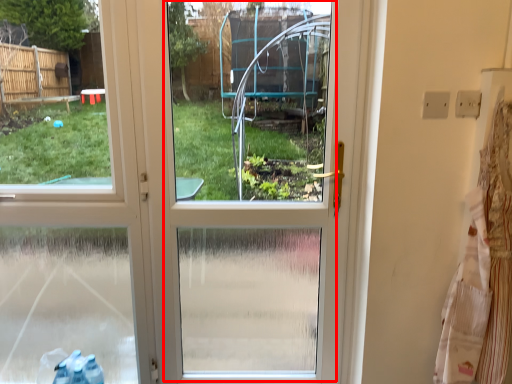
Question: Considering the relative positions of screen door (annotated by the red box) and laundry in the image provided, where is screen door (annotated by the red box) located with respect to the staircase?

Choices:
 (A) left
 (B) right

Answer: (A)